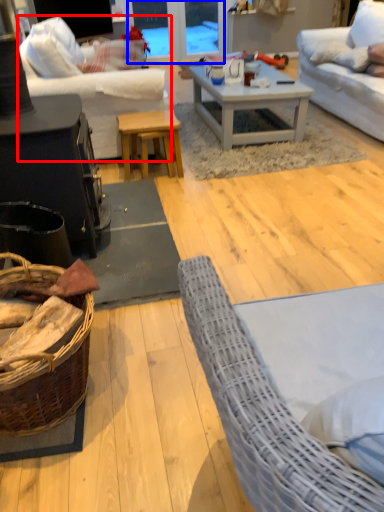
Question: Which object is closer to the camera taking this photo, studio couch (highlighted by a red box) or glass door (highlighted by a blue box)?

Choices:
 (A) studio couch
 (B) glass door

Answer: (A)